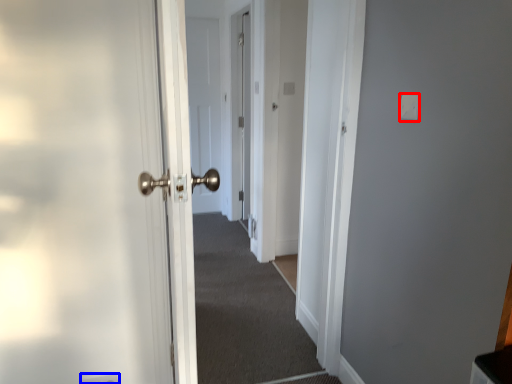
Question: Which point is closer to the camera, light switch (highlighted by a red box) or electric outlet (highlighted by a blue box)?

Choices:
 (A) light switch
 (B) electric outlet

Answer: (A)